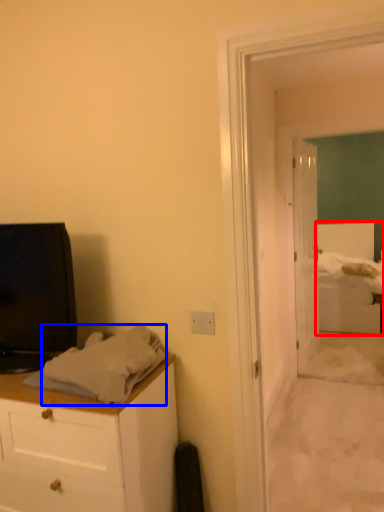
Question: Which point is further to the camera, bed (highlighted by a red box) or sheet (highlighted by a blue box)?

Choices:
 (A) bed
 (B) sheet

Answer: (A)